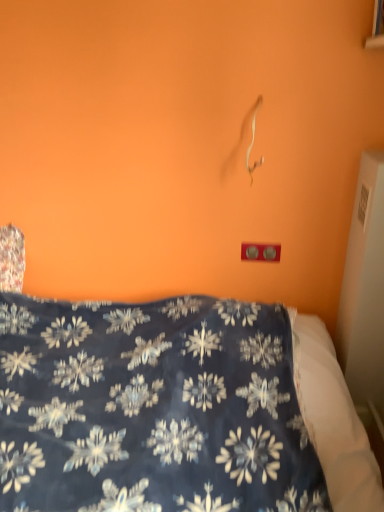
Question: From a real-world perspective, is dark blue fabric at center positioned over matte plastic outlet at center based on gravity?

Choices:
 (A) no
 (B) yes

Answer: (A)

Question: Considering the relative sizes of dark blue fabric at center and matte plastic outlet at center in the image provided, is dark blue fabric at center taller than matte plastic outlet at center?

Choices:
 (A) yes
 (B) no

Answer: (A)

Question: From a real-world perspective, is dark blue fabric at center located beneath matte plastic outlet at center?

Choices:
 (A) no
 (B) yes

Answer: (B)

Question: Does dark blue fabric at center turn towards matte plastic outlet at center?

Choices:
 (A) yes
 (B) no

Answer: (B)

Question: Considering the relative sizes of dark blue fabric at center and matte plastic outlet at center in the image provided, is dark blue fabric at center wider than matte plastic outlet at center?

Choices:
 (A) no
 (B) yes

Answer: (B)

Question: Can you confirm if dark blue fabric at center is positioned to the left of matte plastic outlet at center?

Choices:
 (A) yes
 (B) no

Answer: (A)

Question: Is matte plastic outlet at center completely or partially outside of dark blue fabric at center?

Choices:
 (A) no
 (B) yes

Answer: (B)

Question: Does matte plastic outlet at center turn towards dark blue fabric at center?

Choices:
 (A) no
 (B) yes

Answer: (A)

Question: Is matte plastic outlet at center positioned with its back to dark blue fabric at center?

Choices:
 (A) yes
 (B) no

Answer: (B)

Question: Considering the relative positions of matte plastic outlet at center and dark blue fabric at center in the image provided, is matte plastic outlet at center in front of dark blue fabric at center?

Choices:
 (A) no
 (B) yes

Answer: (A)

Question: Does matte plastic outlet at center touch dark blue fabric at center?

Choices:
 (A) yes
 (B) no

Answer: (B)

Question: From the image's perspective, is matte plastic outlet at center under dark blue fabric at center?

Choices:
 (A) no
 (B) yes

Answer: (A)

Question: Which is correct: dark blue fabric at center is inside matte plastic outlet at center, or outside of it?

Choices:
 (A) outside
 (B) inside

Answer: (A)